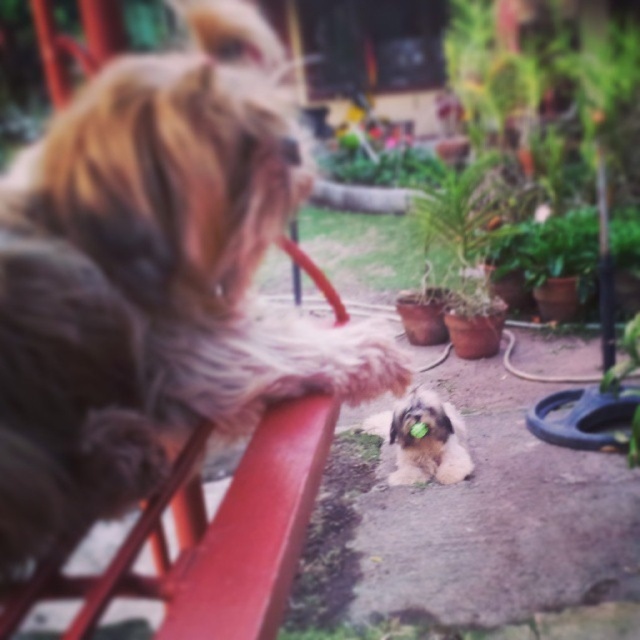
Looking at this image, does fluffy white dog at center come behind green leafy plant at lower right?

Yes, it is behind green leafy plant at lower right.

Locate an element on the screen. fluffy white dog at center is located at coordinates (426, 440).

Which is above, fluffy white dog at center or green leafy plant at center?

green leafy plant at center is higher up.

Who is shorter, fluffy white dog at center or green leafy plant at center?

Standing shorter between the two is fluffy white dog at center.

Is point (436, 474) more distant than point (392, 164)?

No, (436, 474) is in front of (392, 164).

Where is `fluffy white dog at center`? This screenshot has height=640, width=640. fluffy white dog at center is located at coordinates (426, 440).

Between fuzzy brown dog at upper left and fluffy white dog at center, which one is positioned higher?

fuzzy brown dog at upper left

Is point (186, 138) in front of point (401, 420)?

Yes, point (186, 138) is closer to viewer.

You are a GUI agent. You are given a task and a screenshot of the screen. Output one action in this format:
    pyautogui.click(x=<x>, y=<y>)
    Task: Click on the fuzzy brown dog at upper left
    The height and width of the screenshot is (640, 640).
    Given the screenshot: What is the action you would take?
    pyautogui.click(x=154, y=280)